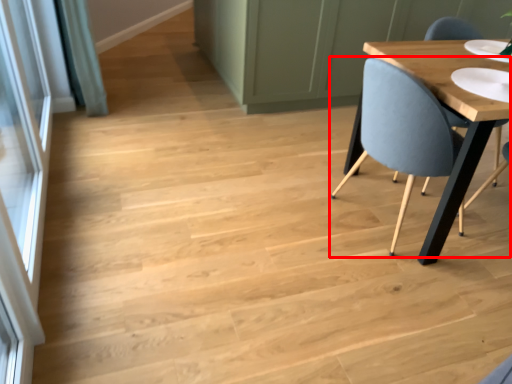
Question: From the image, what is the correct spatial relationship of chair (annotated by the red box) in relation to screen door?

Choices:
 (A) right
 (B) left

Answer: (A)